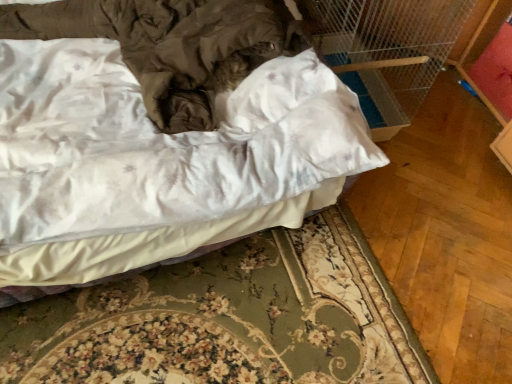
Question: Should I look upward or downward to see satin white bed at center?

Choices:
 (A) up
 (B) down

Answer: (A)

Question: Can you confirm if satin white bed at center is shorter than white fabric bed frame at lower center?

Choices:
 (A) yes
 (B) no

Answer: (B)

Question: Does satin white bed at center have a smaller size compared to white fabric bed frame at lower center?

Choices:
 (A) no
 (B) yes

Answer: (A)

Question: From the image's perspective, is satin white bed at center under white fabric bed frame at lower center?

Choices:
 (A) no
 (B) yes

Answer: (A)

Question: From the image's perspective, is satin white bed at center located above white fabric bed frame at lower center?

Choices:
 (A) yes
 (B) no

Answer: (A)

Question: Does satin white bed at center have a larger size compared to white fabric bed frame at lower center?

Choices:
 (A) no
 (B) yes

Answer: (B)

Question: From a real-world perspective, is satin white bed at center physically above white fabric bed frame at lower center?

Choices:
 (A) yes
 (B) no

Answer: (A)

Question: Is white fabric bed frame at lower center oriented away from satin white bed at center?

Choices:
 (A) yes
 (B) no

Answer: (B)

Question: Is satin white bed at center surrounded by white fabric bed frame at lower center?

Choices:
 (A) no
 (B) yes

Answer: (A)

Question: From a real-world perspective, is white fabric bed frame at lower center physically above satin white bed at center?

Choices:
 (A) no
 (B) yes

Answer: (A)

Question: Could you tell me if white fabric bed frame at lower center is facing satin white bed at center?

Choices:
 (A) no
 (B) yes

Answer: (A)

Question: From a real-world perspective, is white fabric bed frame at lower center below satin white bed at center?

Choices:
 (A) no
 (B) yes

Answer: (B)

Question: Can you confirm if white fabric bed frame at lower center is smaller than satin white bed at center?

Choices:
 (A) no
 (B) yes

Answer: (B)

Question: From the image's perspective, is satin white bed at center positioned above or below white fabric bed frame at lower center?

Choices:
 (A) below
 (B) above

Answer: (B)